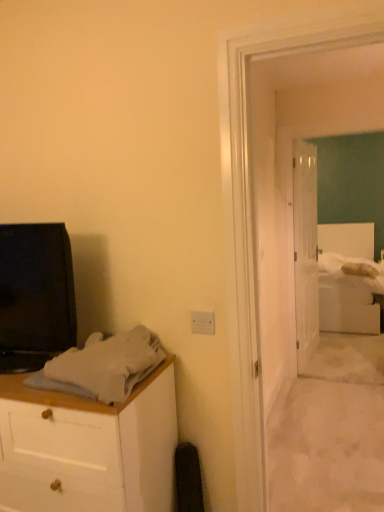
Question: Is white soft bedsheet at center-right, the second sheet from the bottom, wider or thinner than white glossy door at center?

Choices:
 (A) thin
 (B) wide

Answer: (B)

Question: Is point (342, 265) positioned closer to the camera than point (292, 227)?

Choices:
 (A) closer
 (B) farther

Answer: (B)

Question: Based on their relative distances, which object is nearer to the gray cotton sheet at left, the 1th sheet in the front-to-back sequence?

Choices:
 (A) black glossy tv at left
 (B) white soft bedsheet at center-right, positioned as the 1th sheet in back-to-front order
 (C) white glossy door at center
 (D) white soft bed at right

Answer: (A)

Question: Estimate the real-world distances between objects in this image. Which object is closer to the white glossy door at center?

Choices:
 (A) gray cotton sheet at left, the first sheet in the bottom-to-top sequence
 (B) white soft bedsheet at center-right, the 1th sheet from the top
 (C) black glossy tv at left
 (D) white soft bed at right

Answer: (D)